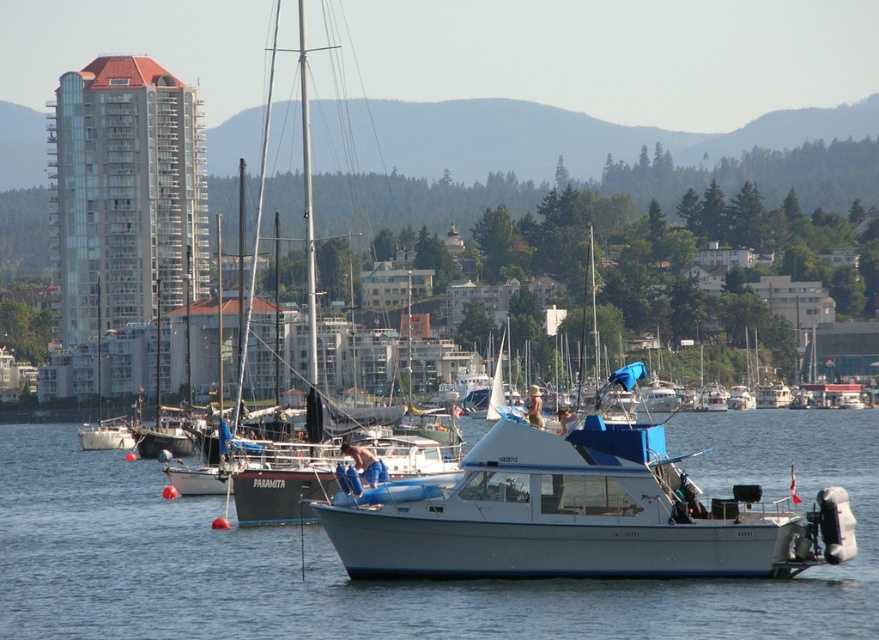
Locate an element on the screen. This screenshot has height=640, width=879. white glossy water at center is located at coordinates (400, 580).

Between point (277, 588) and point (309, 195), which one is positioned behind?

Positioned behind is point (309, 195).

Describe the element at coordinates (400, 580) in the screenshot. I see `white glossy water at center` at that location.

The width and height of the screenshot is (879, 640). Find the location of `white glossy water at center`. white glossy water at center is located at coordinates (400, 580).

Is white glossy water at center positioned in front of white glossy boat at center?

Yes, it is in front of white glossy boat at center.

Does white glossy water at center appear on the left side of white glossy boat at center?

Correct, you'll find white glossy water at center to the left of white glossy boat at center.

Describe the element at coordinates (400, 580) in the screenshot. I see `white glossy water at center` at that location.

Find the location of a particular element. This screenshot has width=879, height=640. white glossy water at center is located at coordinates (400, 580).

Does white glossy boat at center lie behind white matte sailboat at center?

No.

Consider the image. Is white glossy boat at center below white matte sailboat at center?

Correct, white glossy boat at center is located below white matte sailboat at center.

Image resolution: width=879 pixels, height=640 pixels. I want to click on white glossy boat at center, so click(578, 513).